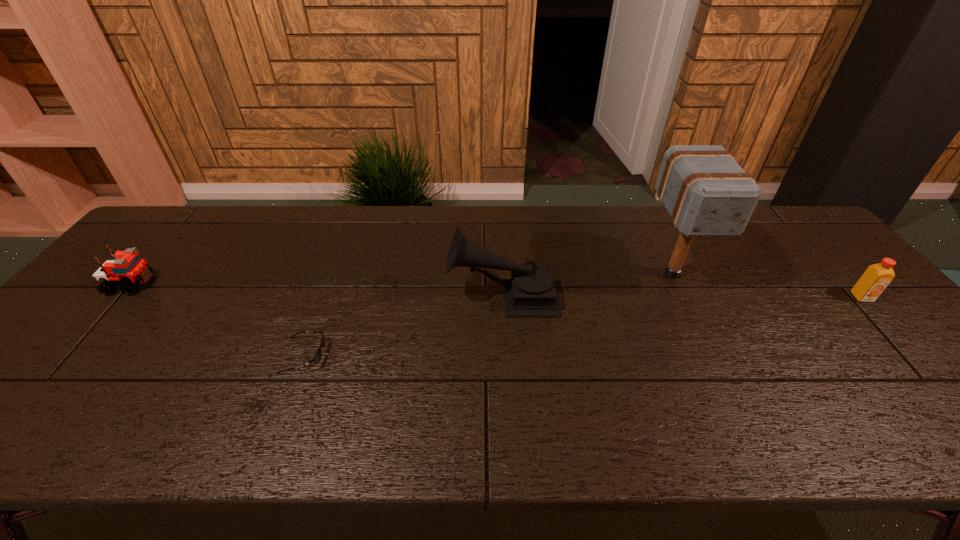
I want to click on unoccupied position between the leftmost object and the shortest object, so click(218, 320).

The image size is (960, 540). Identify the location of free area in between the leftmost object and the orange juice. (497, 291).

Locate an element on the screen. the fourth closest object to the rightmost object is located at coordinates (126, 268).

Identify the location of the closest object to the fourth object from left to right. Image resolution: width=960 pixels, height=540 pixels. (531, 291).

Image resolution: width=960 pixels, height=540 pixels. I want to click on blank space that satisfies the following two spatial constraints: 1. on the striking surface of the second object from right to left; 2. from the horn of the fourth shortest object, so tap(682, 295).

Locate an element on the screen. This screenshot has height=540, width=960. free location that satisfies the following two spatial constraints: 1. on the striking surface of the tallest object; 2. on the front-facing side of the shortest object is located at coordinates (711, 356).

You are a GUI agent. You are given a task and a screenshot of the screen. Output one action in this format:
    pyautogui.click(x=<x>, y=<y>)
    Task: Click on the free space that satisfies the following two spatial constraints: 1. on the front and back of the rightmost object; 2. on the front-facing side of the shortest object
    
    Given the screenshot: What is the action you would take?
    pyautogui.click(x=915, y=356)

This screenshot has height=540, width=960. I want to click on vacant area that satisfies the following two spatial constraints: 1. on the striking surface of the tallest object; 2. from the horn of the fourth shortest object, so click(682, 295).